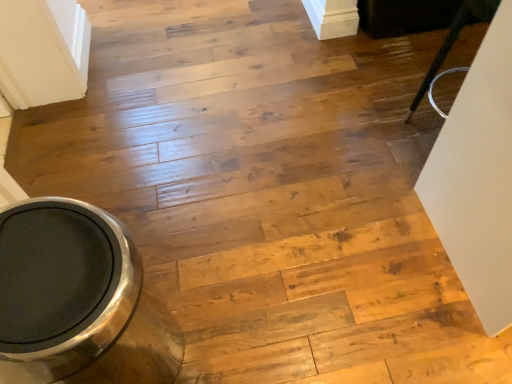
Question: Would you say polished stainless steel toilet bowl at lower left is to the left or to the right of black glossy chair at upper right in the picture?

Choices:
 (A) right
 (B) left

Answer: (B)

Question: Looking at their shapes, would you say polished stainless steel toilet bowl at lower left is wider or thinner than black glossy chair at upper right?

Choices:
 (A) wide
 (B) thin

Answer: (A)

Question: Does point (76, 283) appear closer or farther from the camera than point (413, 112)?

Choices:
 (A) closer
 (B) farther

Answer: (A)

Question: Is point (428, 86) positioned closer to the camera than point (17, 251)?

Choices:
 (A) closer
 (B) farther

Answer: (B)

Question: Would you say black glossy chair at upper right is inside or outside polished stainless steel toilet bowl at lower left?

Choices:
 (A) outside
 (B) inside

Answer: (A)

Question: From a real-world perspective, relative to polished stainless steel toilet bowl at lower left, is black glossy chair at upper right vertically above or below?

Choices:
 (A) below
 (B) above

Answer: (B)

Question: Based on their positions, is black glossy chair at upper right located to the left or right of polished stainless steel toilet bowl at lower left?

Choices:
 (A) left
 (B) right

Answer: (B)